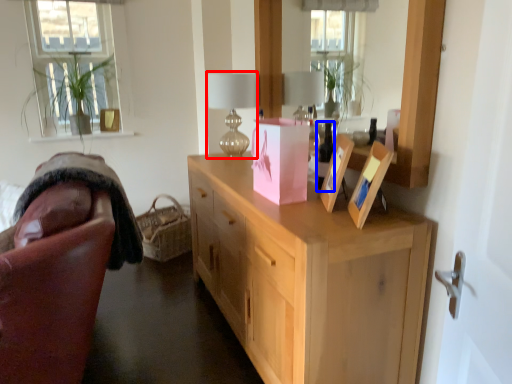
Question: Which of the following is the closest to the observer, table lamp (highlighted by a red box) or wine bottle (highlighted by a blue box)?

Choices:
 (A) table lamp
 (B) wine bottle

Answer: (B)